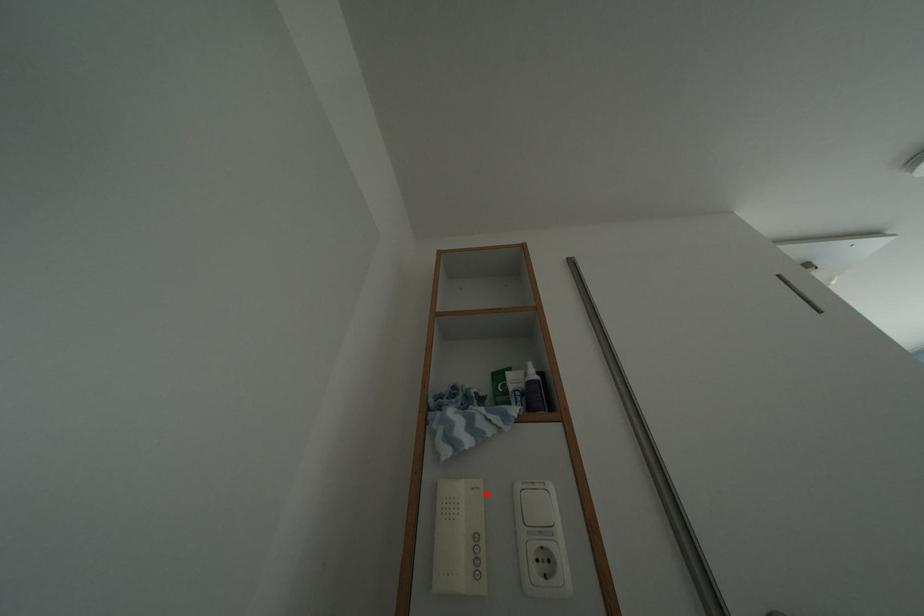
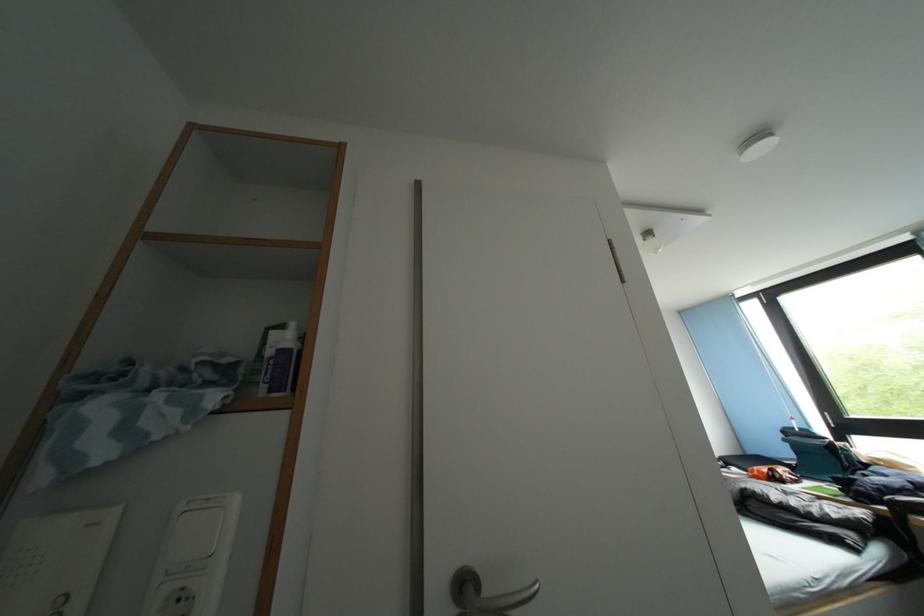
The point at the highlighted location is marked in the first image. Where is the corresponding point in the second image?

(107, 528)